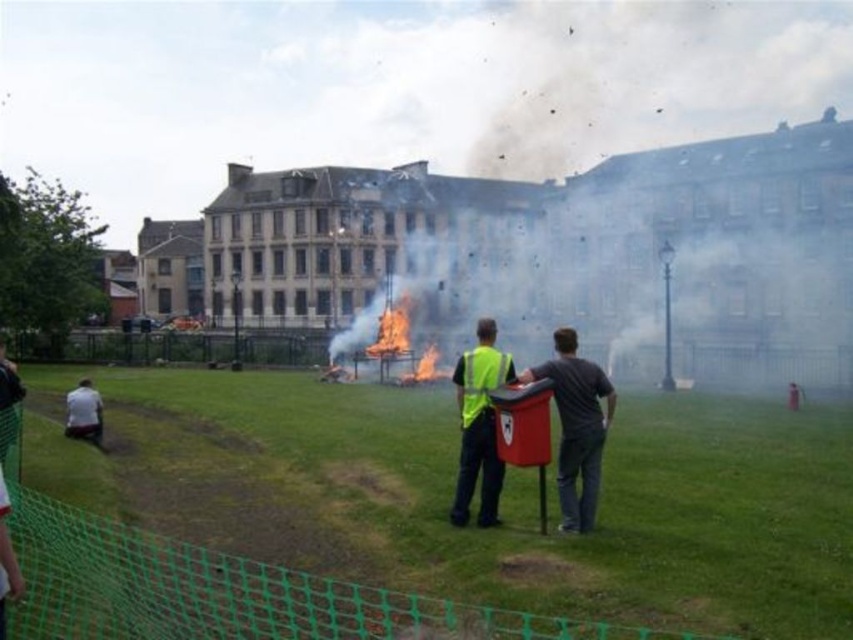
Question: Is dark gray fabric shirt at center to the left of flamematerial/texturefire at center from the viewer's perspective?

Choices:
 (A) no
 (B) yes

Answer: (A)

Question: Can you confirm if dark gray fabric shirt at center is smaller than yellow reflective vest at center?

Choices:
 (A) yes
 (B) no

Answer: (A)

Question: Which object is farther from the camera taking this photo?

Choices:
 (A) flamematerial/texturefire at center
 (B) yellow reflective vest at center

Answer: (A)

Question: Which object is positioned closest to the dark gray fabric shirt at center?

Choices:
 (A) yellow reflective vest at center
 (B) white smoke at center

Answer: (A)

Question: Estimate the real-world distances between objects in this image. Which object is closer to the white smoke at center?

Choices:
 (A) flamematerial/texturefire at center
 (B) dark gray fabric shirt at center
 (C) yellow reflective vest at center

Answer: (A)

Question: Is yellow reflective vest at center above flamematerial/texturefire at center?

Choices:
 (A) yes
 (B) no

Answer: (B)